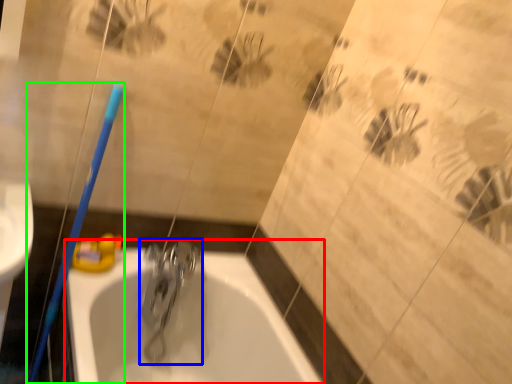
Question: Considering the real-world distances, which object is farthest from bathtub (highlighted by a red box)? tap (highlighted by a blue box) or toothbrush (highlighted by a green box)?

Choices:
 (A) tap
 (B) toothbrush

Answer: (B)